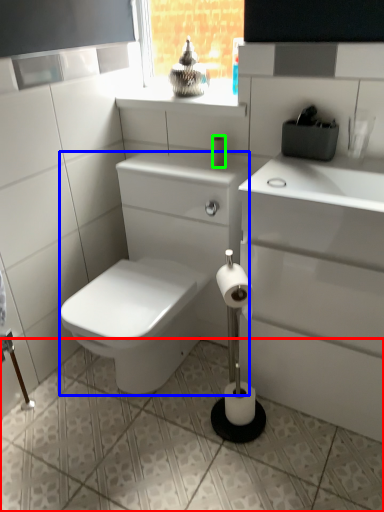
Question: Considering the real-world distances, which object is farthest from ceramic tile (highlighted by a red box)? porcelain (highlighted by a blue box) or toilet paper (highlighted by a green box)?

Choices:
 (A) porcelain
 (B) toilet paper

Answer: (B)